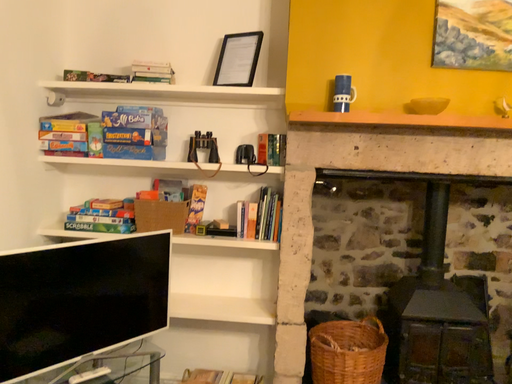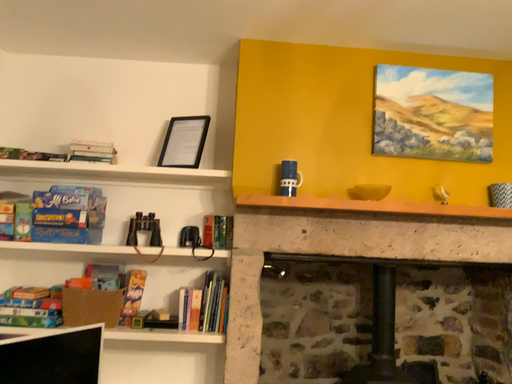
Question: How did the camera likely rotate when shooting the video?

Choices:
 (A) rotated left
 (B) rotated right

Answer: (B)